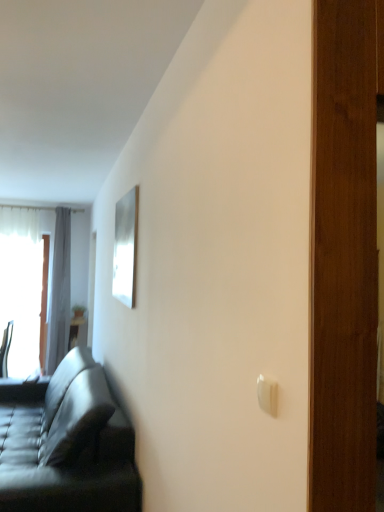
Describe the element at coordinates (67, 447) in the screenshot. This screenshot has width=384, height=512. I see `leather couch at left` at that location.

Identify the location of leather couch at left. (67, 447).

Does white sheer curtain at left turn towards leather couch at left?

Yes, white sheer curtain at left is turned towards leather couch at left.

Measure the distance from white sheer curtain at left to leather couch at left.

white sheer curtain at left is 2.67 meters from leather couch at left.

From a real-world perspective, is white sheer curtain at left under leather couch at left?

No, from a real-world perspective, white sheer curtain at left is not under leather couch at left.

Considering the positions of objects leather couch at left and white sheer curtain at left in the image provided, who is more to the left, leather couch at left or white sheer curtain at left?

Positioned to the left is white sheer curtain at left.

Based on the photo, is white sheer curtain at left located within leather couch at left?

No.

From a real-world perspective, which object stands above the other?

From a 3D spatial view, white sheer curtain at left is above.

This screenshot has width=384, height=512. Identify the location of window that is above the leather couch at left (from the image's perspective). (21, 286).

How far apart are gray fabric curtain at left and leather couch at left?

gray fabric curtain at left is 2.72 meters away from leather couch at left.

Consider the image. Considering the sizes of gray fabric curtain at left and leather couch at left in the image, is gray fabric curtain at left bigger or smaller than leather couch at left?

Clearly, gray fabric curtain at left is smaller in size than leather couch at left.

Would you say gray fabric curtain at left is a long distance from leather couch at left?

Yes, gray fabric curtain at left and leather couch at left are located far from each other.

Based on their positions, is gray fabric curtain at left located to the left or right of leather couch at left?

In the image, gray fabric curtain at left appears on the left side of leather couch at left.

Does point (37, 255) come behind point (86, 320)?

Yes, point (37, 255) is farther from viewer.

In the scene shown: From a real-world perspective, which is physically above, white sheer curtain at left or wooden table at left?

white sheer curtain at left.

Is white sheer curtain at left thinner than wooden table at left?

Correct, the width of white sheer curtain at left is less than that of wooden table at left.

Looking at this image, in terms of height, does white sheer curtain at left look taller or shorter compared to wooden table at left?

Considering their sizes, white sheer curtain at left has more height than wooden table at left.

How different are the orientations of wooden table at left and gray fabric curtain at left in degrees?

They differ by 0.000479 degrees in their facing directions.

Can you confirm if wooden table at left is bigger than gray fabric curtain at left?

No, wooden table at left is not bigger than gray fabric curtain at left.

Considering the positions of objects wooden table at left and gray fabric curtain at left in the image provided, who is in front, wooden table at left or gray fabric curtain at left?

gray fabric curtain at left is closer to the camera.

Could you tell me if wooden table at left is turned towards gray fabric curtain at left?

No, wooden table at left is not facing towards gray fabric curtain at left.

Is point (61, 316) closer to viewer compared to point (79, 320)?

No, (61, 316) is behind (79, 320).

Is gray fabric curtain at left smaller than wooden table at left?

Incorrect, gray fabric curtain at left is not smaller in size than wooden table at left.

Who is taller, gray fabric curtain at left or wooden table at left?

With more height is gray fabric curtain at left.

Measure the distance from gray fabric curtain at left to wooden table at left.

The distance of gray fabric curtain at left from wooden table at left is 53.60 centimeters.

Can you confirm if metallic silver chair at left is taller than leather couch at left?

Incorrect, the height of metallic silver chair at left is not larger of that of leather couch at left.

Do you think metallic silver chair at left is within leather couch at left, or outside of it?

metallic silver chair at left lies outside leather couch at left.

Looking at this image, is metallic silver chair at left in front of or behind leather couch at left in the image?

metallic silver chair at left is behind leather couch at left.

How many degrees apart are the facing directions of metallic silver chair at left and leather couch at left?

metallic silver chair at left and leather couch at left are facing 86.4 degrees away from each other.

Identify the location of studio couch lying in front of the white sheer curtain at left. (67, 447).

Locate an element on the screen. window on the left of leather couch at left is located at coordinates (21, 286).

Considering their positions, is gray fabric curtain at left positioned closer to metallic silver chair at left than white sheer curtain at left?

white sheer curtain at left.

From the image, which object appears to be nearer to white plastic light switch at lower right, wooden table at left or gray fabric curtain at left?

wooden table at left.

Considering their positions, is gray fabric curtain at left positioned closer to wooden table at left than white sheer curtain at left?

gray fabric curtain at left lies closer to wooden table at left than the other object.

Which object lies nearer to the anchor point leather couch at left, white sheer curtain at left or wooden table at left?

The object closer to leather couch at left is wooden table at left.

Which object lies further to the anchor point gray fabric curtain at left, white sheer curtain at left or metallic silver chair at left?

Among the two, metallic silver chair at left is located further to gray fabric curtain at left.

From the image, which object appears to be farther from wooden table at left, leather couch at left or white plastic light switch at lower right?

white plastic light switch at lower right lies further to wooden table at left than the other object.

Based on their spatial positions, is wooden table at left or gray fabric curtain at left closer to white sheer curtain at left?

gray fabric curtain at left is closer to white sheer curtain at left.

When comparing their distances from metallic silver chair at left, does leather couch at left or white sheer curtain at left seem closer?

white sheer curtain at left is positioned closer to the anchor metallic silver chair at left.

Where is `chair between white plastic light switch at lower right and white sheer curtain at left in the front-back direction`? chair between white plastic light switch at lower right and white sheer curtain at left in the front-back direction is located at coordinates (5, 349).

Image resolution: width=384 pixels, height=512 pixels. I want to click on studio couch positioned between white plastic light switch at lower right and wooden table at left from near to far, so click(67, 447).

Find the location of a particular element. studio couch between white plastic light switch at lower right and white sheer curtain at left from front to back is located at coordinates (67, 447).

Locate an element on the screen. Image resolution: width=384 pixels, height=512 pixels. chair between leather couch at left and white sheer curtain at left along the z-axis is located at coordinates (5, 349).